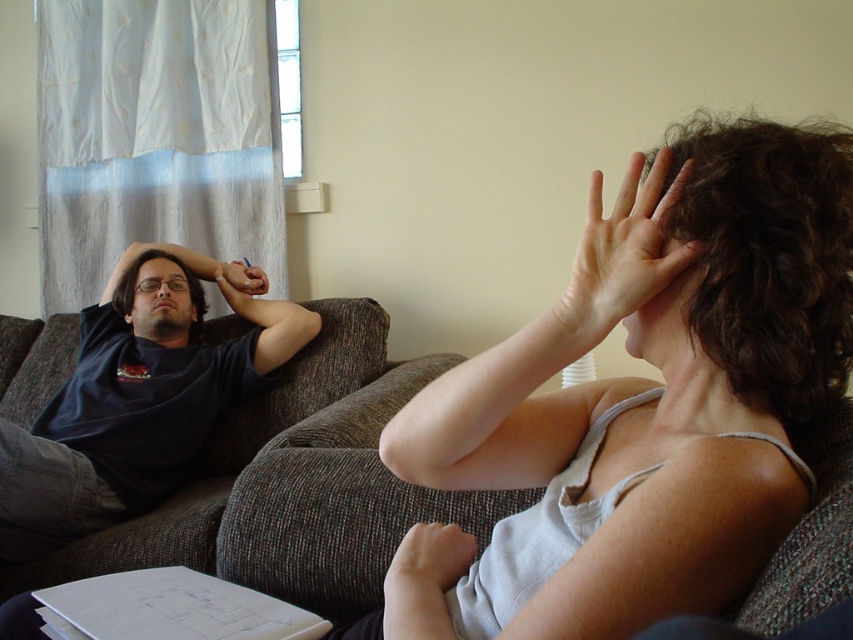
You are a photographer trying to capture a candid shot of the two people on the sofa. You want to ensure that the matte skin hand at upper right does not block the view of the matte black head at left. Based on their positions, is this possible?

The matte skin hand at upper right is located below the matte black head at left, so it will not block the view. The photographer can capture the shot without obstruction.